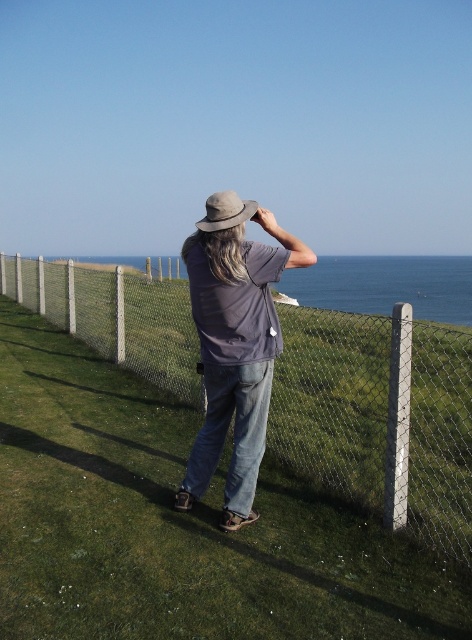
You are a fashion designer observing a person in a coastal area. You notice the denim jeans at center and the light brown felt hat at center. Which clothing item is located to the right when viewed from the front?

The denim jeans at center is positioned on the right side of light brown felt hat at center, so the denim jeans at center is located to the right when viewed from the front.

You are a fashion designer observing a person wearing denim jeans at center and light brown felt hat at center. Which item of clothing is wider?

The denim jeans at center is wider than the light brown felt hat at center according to the description.